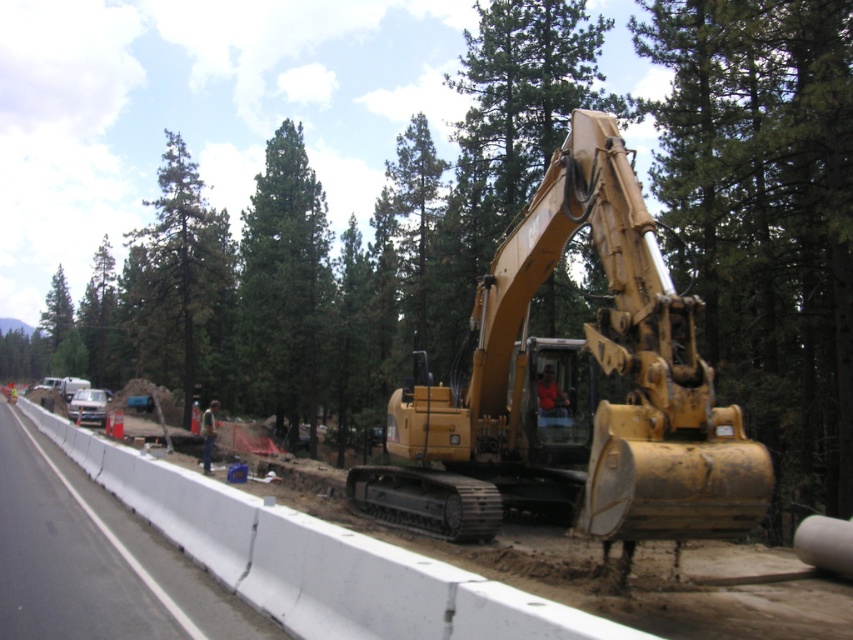
You are standing at the point of observation in the construction scene. You need to locate the yellow metallic excavator at center. What are the coordinates where you can find it?

The yellow metallic excavator at center can be found at coordinates point (573, 387).